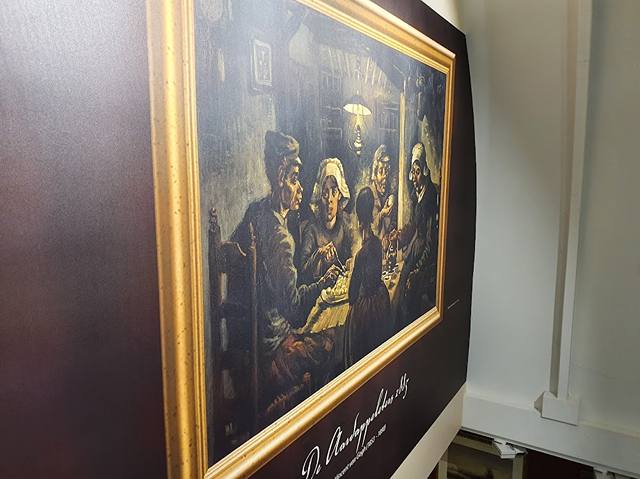
Locate an element on the screen. The height and width of the screenshot is (479, 640). yellow light is located at coordinates (358, 121).